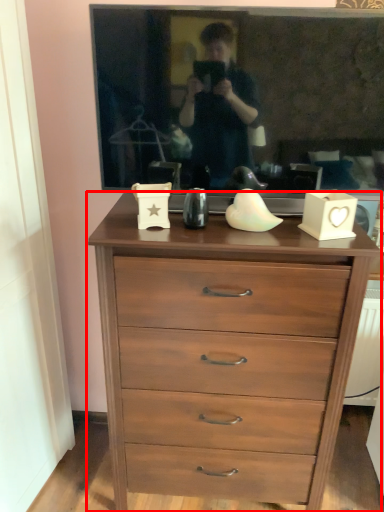
Question: From the image, what is the correct spatial relationship of chest of drawers (annotated by the red box) in relation to picture frame?

Choices:
 (A) left
 (B) right

Answer: (A)